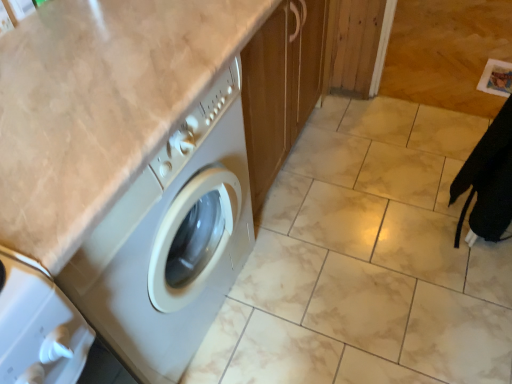
You are a GUI agent. You are given a task and a screenshot of the screen. Output one action in this format:
    pyautogui.click(x=<x>, y=<y>)
    Task: Click on the free spot above beige marble counter top at upper left (from a real-world perspective)
    The height and width of the screenshot is (384, 512).
    Given the screenshot: What is the action you would take?
    pyautogui.click(x=78, y=70)